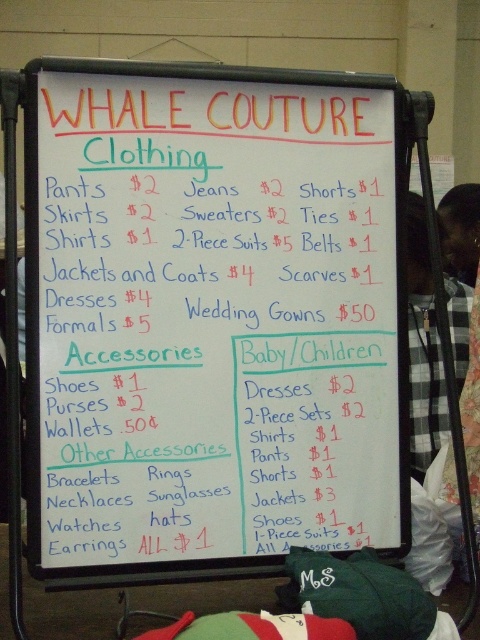
You are standing in front of the white paperboard at center and want to read the prices listed under the Clothing Section. Considering your height and the board being at eye level, can you comfortably read the handwritten text from your current position?

The white paperboard at center is 1.17 meters away from the viewer. Since this distance is within a typical comfortable reading range and the board is at eye level, you can comfortably read the handwritten text from your current position.